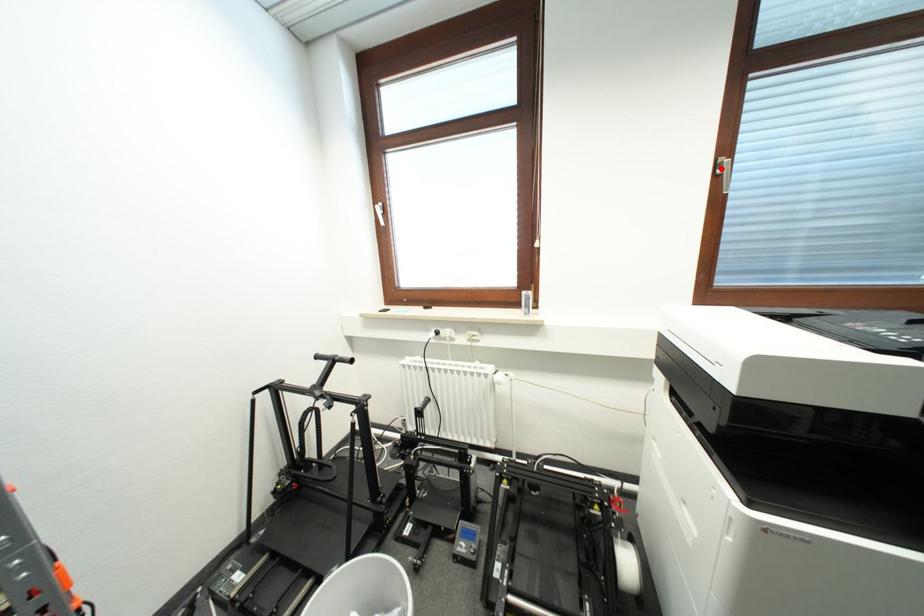
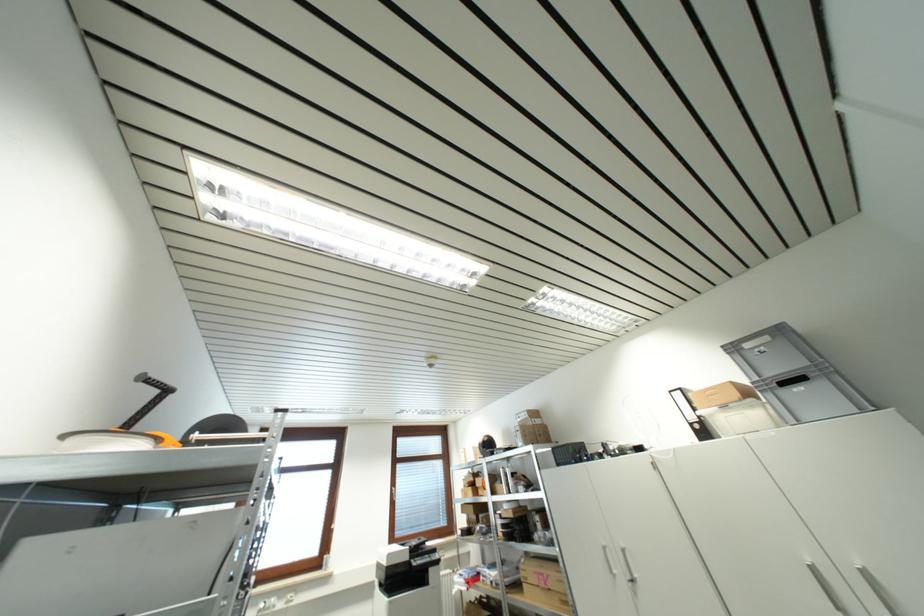
Where in the second image is the point corresponding to the highlighted location from the first image?

(395, 493)